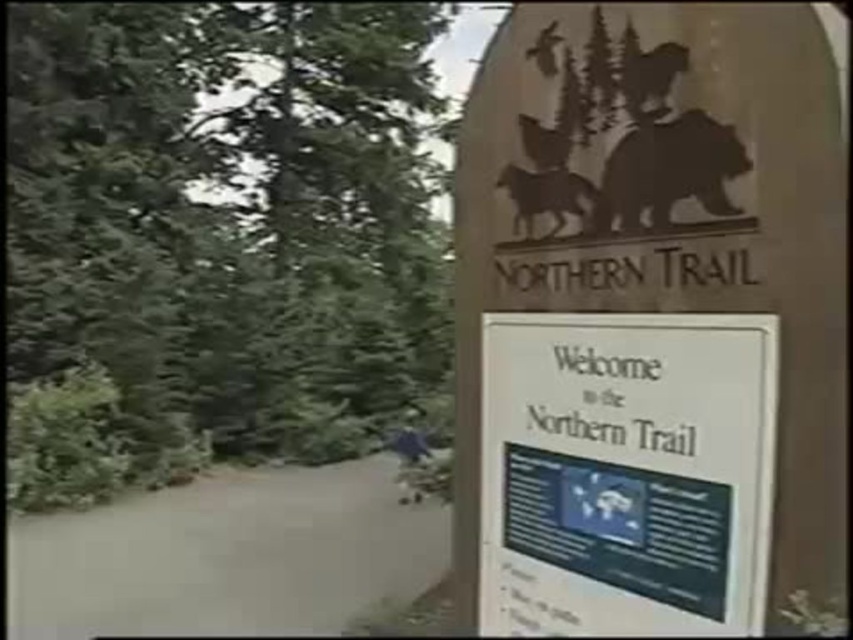
Locate an element on the screen. The image size is (853, 640). green leafy tree at left is located at coordinates (216, 237).

Does green leafy tree at left appear on the left side of brown matte horse at upper center?

Correct, you'll find green leafy tree at left to the left of brown matte horse at upper center.

In order to click on green leafy tree at left in this screenshot , I will do `click(216, 237)`.

Does green leafy tree at left have a lesser width compared to brown matte bear at upper center?

Incorrect, green leafy tree at left's width is not less than brown matte bear at upper center's.

Who is lower down, green leafy tree at left or brown matte bear at upper center?

green leafy tree at left is lower down.

Describe the element at coordinates (216, 237) in the screenshot. I see `green leafy tree at left` at that location.

This screenshot has width=853, height=640. Identify the location of green leafy tree at left. (216, 237).

Between point (360, 12) and point (601, 618), which one is positioned in front?

Positioned in front is point (601, 618).

Is green leafy tree at left wider than white paper sign at center?

Incorrect, green leafy tree at left's width does not surpass white paper sign at center's.

Identify the location of green leafy tree at left. (216, 237).

Locate an element on the screen. green leafy tree at left is located at coordinates (216, 237).